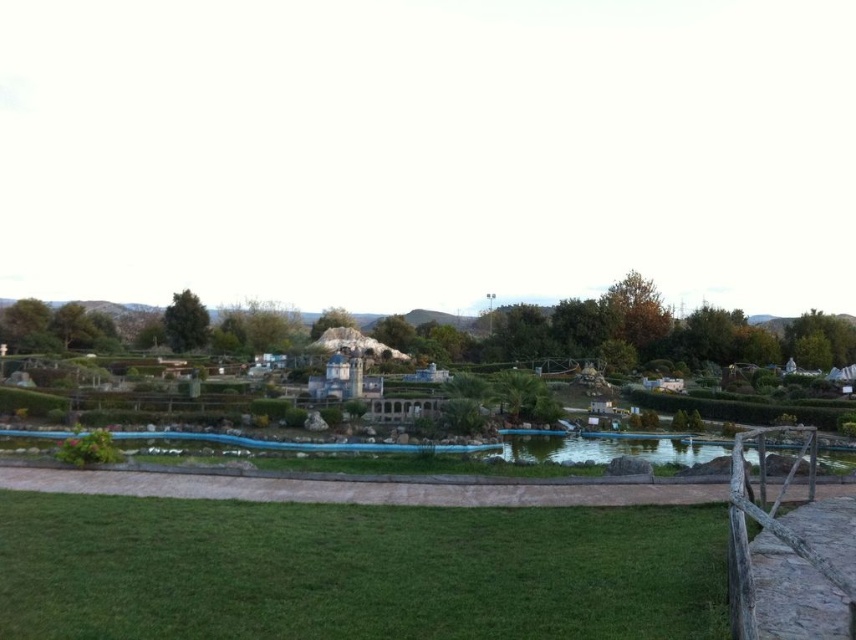
Does green grass at lower center have a larger size compared to smooth concrete miniature park at center?

No, green grass at lower center is not bigger than smooth concrete miniature park at center.

What are the coordinates of `green grass at lower center` in the screenshot? It's located at (355, 570).

Locate an element on the screen. green grass at lower center is located at coordinates (355, 570).

Who is taller, smooth concrete miniature park at center or green glass pond at center?

smooth concrete miniature park at center

Is smooth concrete miniature park at center shorter than green glass pond at center?

No, smooth concrete miniature park at center is not shorter than green glass pond at center.

The width and height of the screenshot is (856, 640). What do you see at coordinates (651, 348) in the screenshot?
I see `smooth concrete miniature park at center` at bounding box center [651, 348].

The height and width of the screenshot is (640, 856). I want to click on smooth concrete miniature park at center, so click(651, 348).

Image resolution: width=856 pixels, height=640 pixels. Describe the element at coordinates (651, 348) in the screenshot. I see `smooth concrete miniature park at center` at that location.

Is smooth concrete miniature park at center taller than transparent blue pond at center?

Yes.

Describe the element at coordinates (651, 348) in the screenshot. This screenshot has height=640, width=856. I see `smooth concrete miniature park at center` at that location.

This screenshot has height=640, width=856. I want to click on smooth concrete miniature park at center, so click(651, 348).